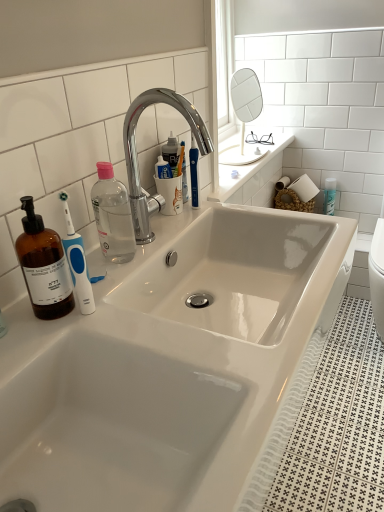
Question: Does point (152, 211) appear closer or farther from the camera than point (253, 94)?

Choices:
 (A) closer
 (B) farther

Answer: (A)

Question: Is chrome/metallic faucet at upper center in front of or behind white glossy mirror at upper center in the image?

Choices:
 (A) behind
 (B) front

Answer: (B)

Question: Considering the relative positions of chrome/metallic faucet at upper center and white glossy mirror at upper center in the image provided, is chrome/metallic faucet at upper center to the left or to the right of white glossy mirror at upper center?

Choices:
 (A) left
 (B) right

Answer: (A)

Question: From a real-world perspective, is white glossy mirror at upper center physically located above or below chrome/metallic faucet at upper center?

Choices:
 (A) below
 (B) above

Answer: (A)

Question: From the image's perspective, is white glossy mirror at upper center above or below chrome/metallic faucet at upper center?

Choices:
 (A) above
 (B) below

Answer: (A)

Question: Is white glossy mirror at upper center taller or shorter than chrome/metallic faucet at upper center?

Choices:
 (A) tall
 (B) short

Answer: (A)

Question: In terms of size, does white glossy mirror at upper center appear bigger or smaller than chrome/metallic faucet at upper center?

Choices:
 (A) small
 (B) big

Answer: (B)